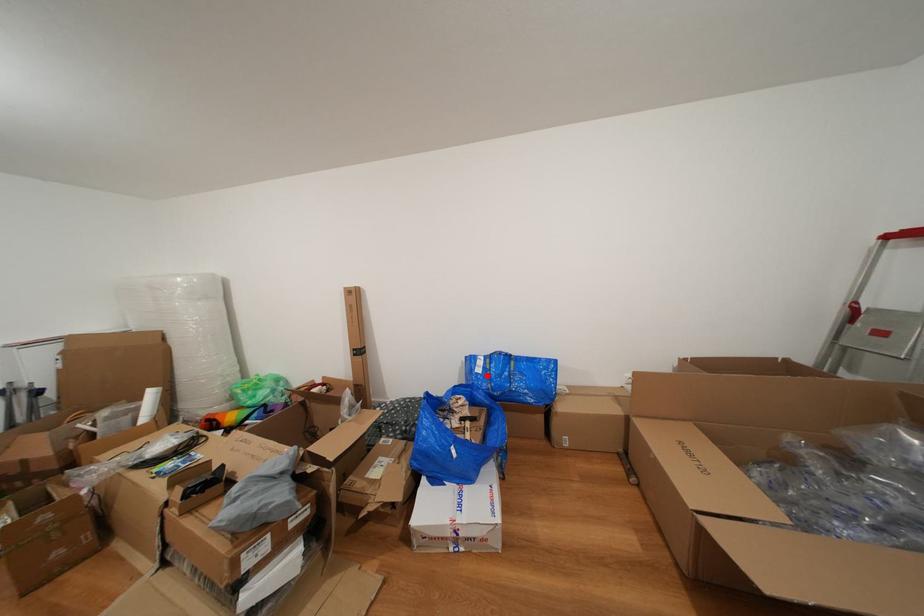
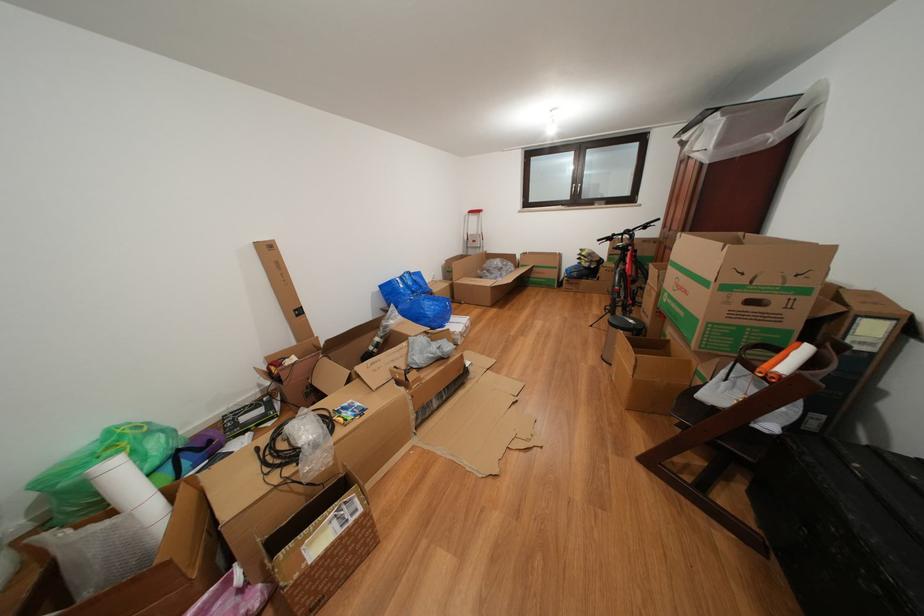
The point at the highlighted location is marked in the first image. Where is the corresponding point in the second image?

(409, 291)